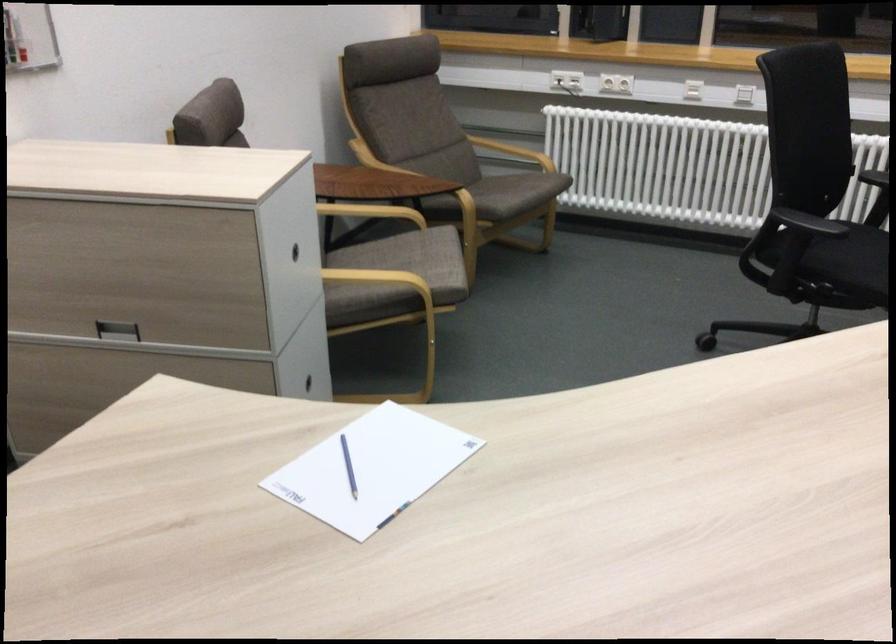
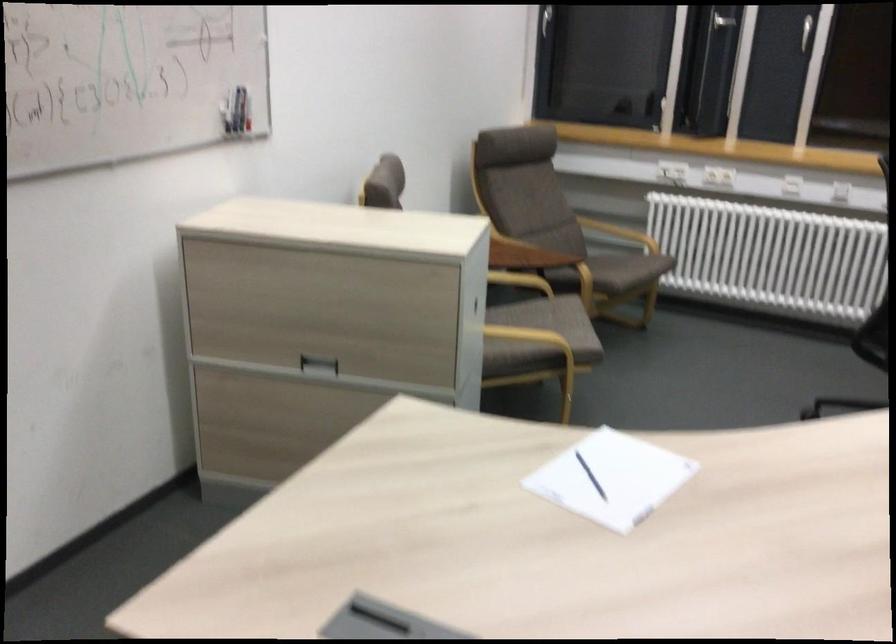
Locate, in the second image, the point that corresponds to (416,259) in the first image.

(552, 321)